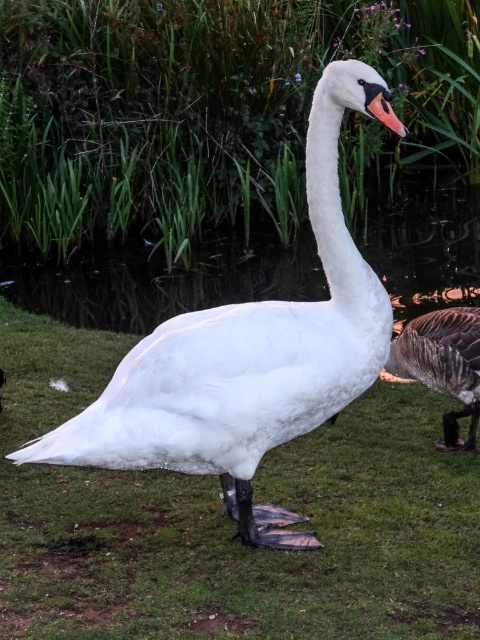
You are a birdwatcher observing the white glossy swan at center and the orange glossy beak at center. Which object is bigger in size?

The white glossy swan at center is larger in size than the orange glossy beak at center.

You are standing at the center of the image and want to locate the white glossy swan at center. According to the coordinates provided, in which direction should you look to find it?

The white glossy swan at center is located at coordinates approximately 0.559 on the x axis and 0.517 on the y axis, which is slightly to the right and below the center point of the image. Therefore, you should look slightly to the right and downward from the exact center to locate it.

You are a birdwatcher observing the scene. You notice the gray matte duck at right and the orange glossy beak at center. Which object is wider?

The gray matte duck at right is wider than the orange glossy beak at center.